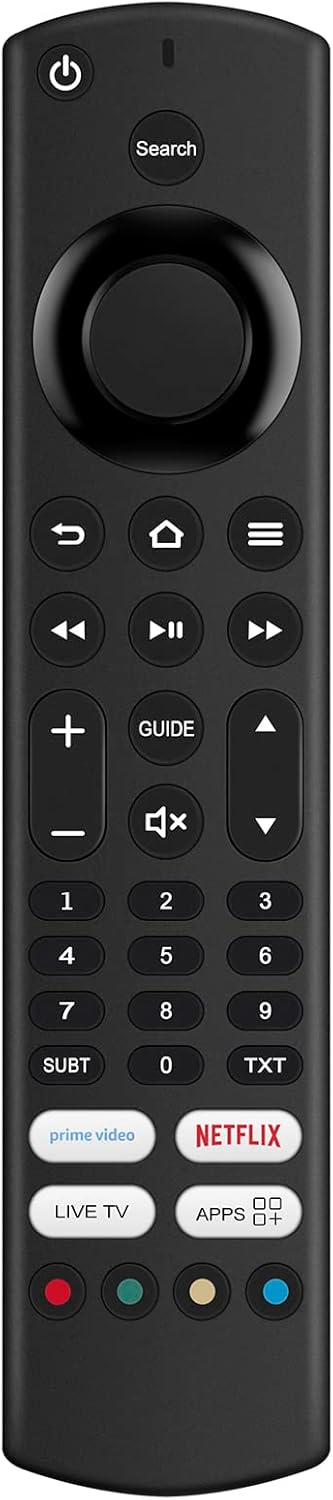
Where is `colored circle buttons on remote`? The image size is (333, 1500). colored circle buttons on remote is located at coordinates (271, 1292), (194, 1290), (131, 1293), (58, 1292).